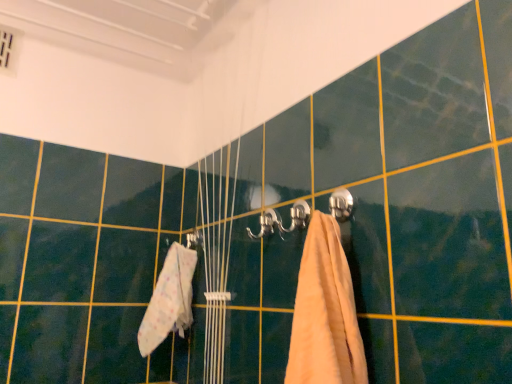
The width and height of the screenshot is (512, 384). What are the coordinates of `white polka dot fabric at left` in the screenshot? It's located at (169, 300).

The image size is (512, 384). Describe the element at coordinates (169, 300) in the screenshot. I see `white polka dot fabric at left` at that location.

Where is `white polka dot fabric at left`? This screenshot has width=512, height=384. white polka dot fabric at left is located at coordinates (169, 300).